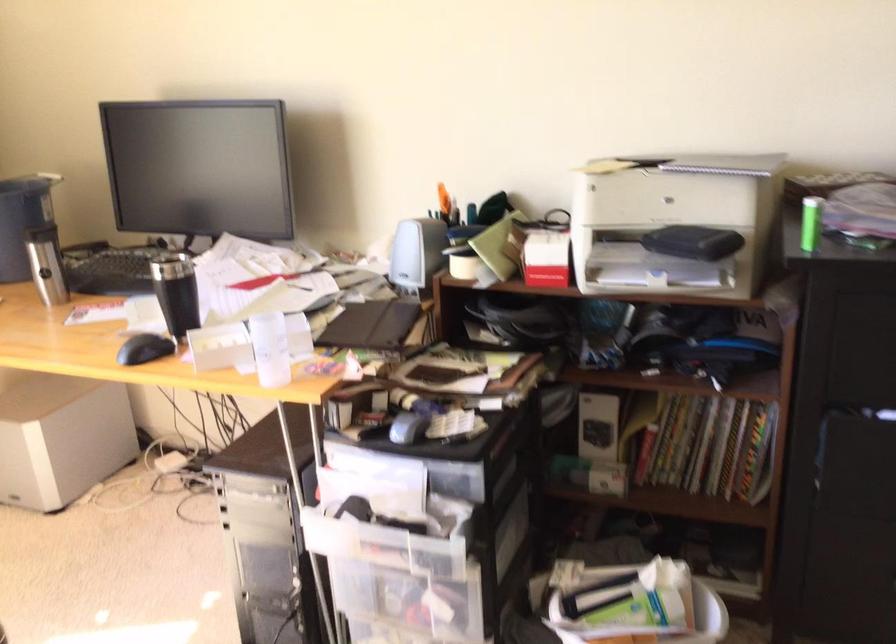
The height and width of the screenshot is (644, 896). In order to click on cabinet drawer handle in this screenshot , I will do tap(866, 413).